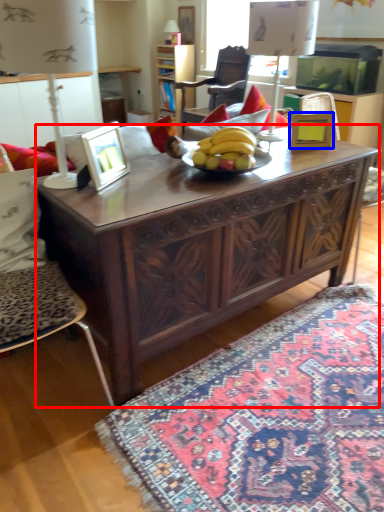
Question: Among these objects, which one is farthest to the camera, table (highlighted by a red box) or picture frame (highlighted by a blue box)?

Choices:
 (A) table
 (B) picture frame

Answer: (B)